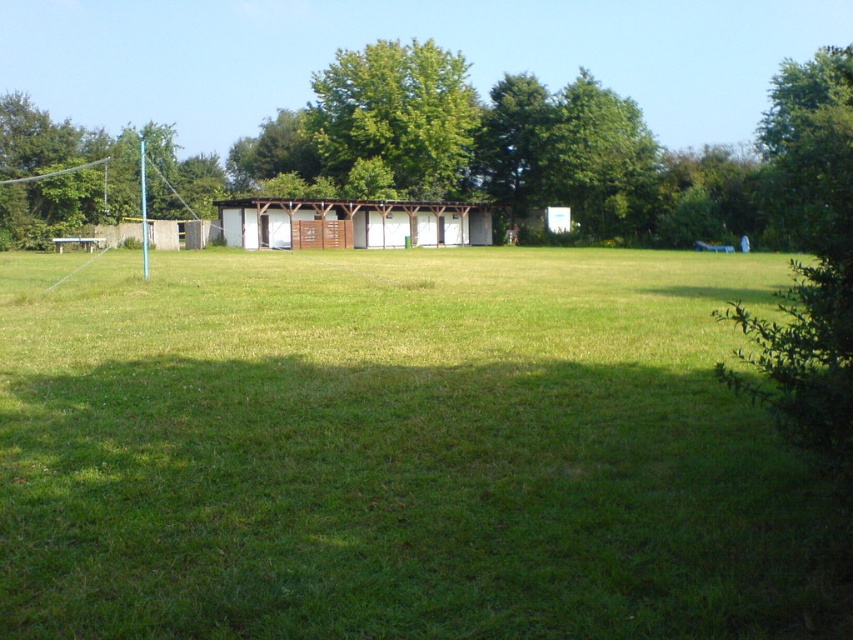
You are standing at the origin point of the coordinate system. You want to walk to the green grassy field at center. What direction should you walk in?

The green grassy field at center is located at coordinates point (396, 451). Since you are at the origin, you should walk towards the positive x and positive y directions to reach it.